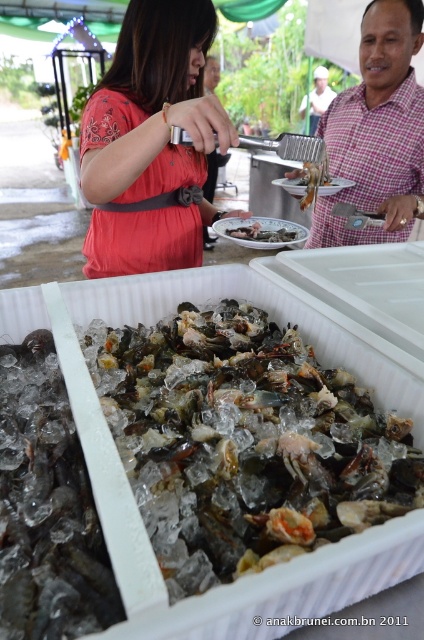
You are a customer at the seafood stall and want to point out the glossy plastic crab at center and translucent glass shrimp at center to the server. Which one is positioned lower in the image?

The glossy plastic crab at center is located below the translucent glass shrimp at center, so it is positioned lower in the image.

You are organizing a seafood buffet and need to arrange the glossy plastic crab at center and the translucent glass shrimp at center on a display shelf. Given their sizes, which one should you place first to maximize shelf space efficiency?

The glossy plastic crab at center occupies less space than the translucent glass shrimp at center, so you should place the translucent glass shrimp at center first to utilize the larger space first and then fit the smaller glossy plastic crab at center efficiently.

What object is located at the coordinates point (245, 442) in the image?

The point (245, 442) indicates translucent ice at center.